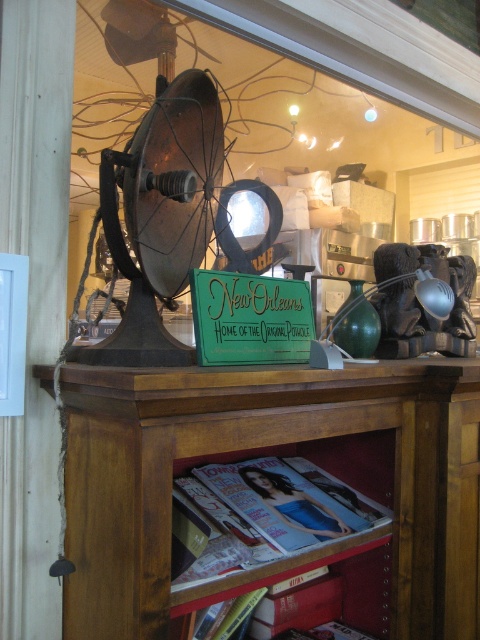
You are a visitor standing in front of the display area. You notice the metallic globe at upper center and the green wood sign at center. Which object is closer to you?

The metallic globe at upper center is closer to you because the green wood sign at center is behind it.

You are a customer in the shop looking for the matte paper magazine at lower center. According to the scene, where should you look relative to the green wood sign at center?

The matte paper magazine at lower center is located below the green wood sign at center, so you should look downward below the green wood sign at center to find it.

You are a visitor in the shop and want to take a photo of the wooden bookshelf at center and the green wood sign at center. Which object should you focus on first if you want to capture both in the same frame without moving your camera?

You should focus on the wooden bookshelf at center first because it is located below the green wood sign at center, so adjusting the camera angle to include both would require framing from the bottom up.